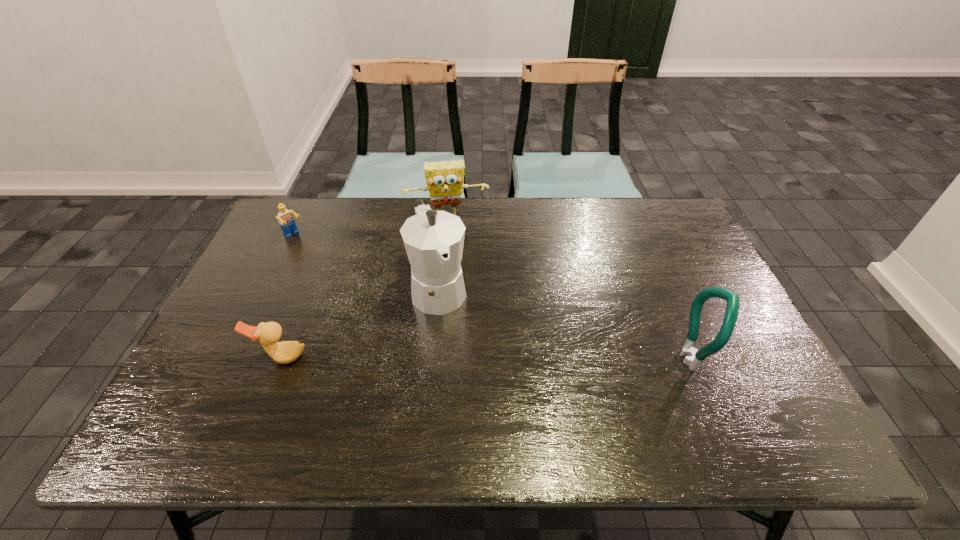
I want to click on free space located on the face of the sponge, so click(x=461, y=292).

In order to click on vacant space located 0.180m on the face of the sponge in this screenshot , I will do `click(457, 265)`.

The image size is (960, 540). Find the location of `free region located 0.130m on the face of the leftmost object`. free region located 0.130m on the face of the leftmost object is located at coordinates (x=324, y=260).

The image size is (960, 540). I want to click on blank space located on the face of the leftmost object, so click(355, 286).

The image size is (960, 540). What are the coordinates of `blank area located 0.230m on the face of the leftmost object` in the screenshot? It's located at (343, 276).

Locate an element on the screen. vacant space located at the spout of the third nearest object is located at coordinates (471, 376).

At what (x,y) coordinates should I click in order to perform the action: click on vacant space located 0.130m at the spout of the third nearest object. Please return your answer as a coordinate pair (x, y). The height and width of the screenshot is (540, 960). Looking at the image, I should click on (464, 359).

The height and width of the screenshot is (540, 960). I want to click on sponge positioned at the far edge, so click(444, 179).

At what (x,y) coordinates should I click in order to perform the action: click on Lego situated at the far edge. Please return your answer as a coordinate pair (x, y). The image size is (960, 540). Looking at the image, I should click on (286, 221).

You are a GUI agent. You are given a task and a screenshot of the screen. Output one action in this format:
    pyautogui.click(x=<x>, y=<y>)
    Task: Click on the object that is positioned at the near edge
    
    Given the screenshot: What is the action you would take?
    pyautogui.click(x=693, y=358)